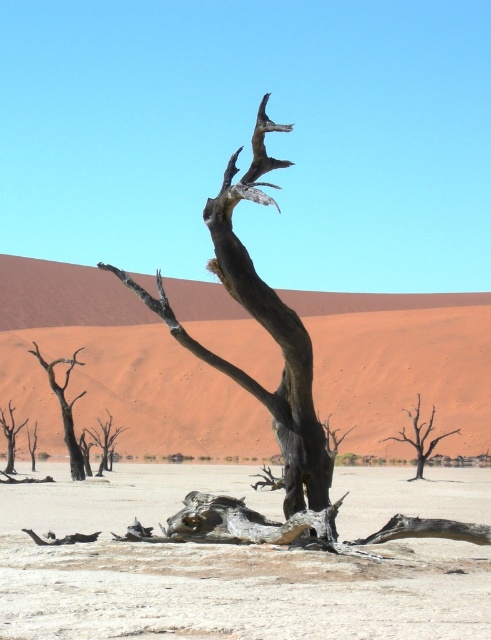
Question: Does dark brown wood tree at left have a smaller size compared to brown textured tree at center?

Choices:
 (A) yes
 (B) no

Answer: (A)

Question: Considering the relative positions of dark gray bark tree at center and brown textured tree at center in the image provided, where is dark gray bark tree at center located with respect to brown textured tree at center?

Choices:
 (A) right
 (B) left

Answer: (B)

Question: Which of the following is the closest to the observer?

Choices:
 (A) smooth sand dune at center
 (B) brown textured tree at center

Answer: (B)

Question: Which object is closer to the camera taking this photo?

Choices:
 (A) charred wood tree trunk at center
 (B) smooth sand dune at center

Answer: (A)

Question: Does smooth sand dune at center have a greater width compared to brown rough tree at center?

Choices:
 (A) yes
 (B) no

Answer: (A)

Question: Which point appears closest to the camera in this image?

Choices:
 (A) (29, 456)
 (B) (71, 465)

Answer: (B)